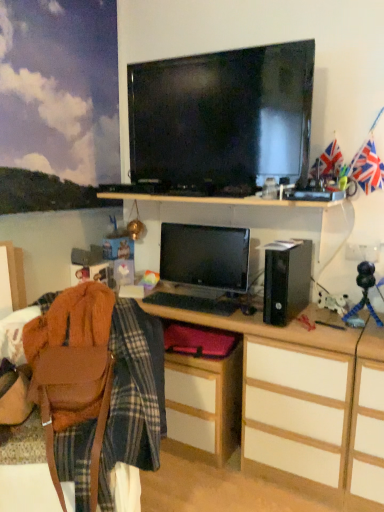
Locate an element on the screen. free spot above matte black television at upper center (from a real-world perspective) is located at coordinates (221, 52).